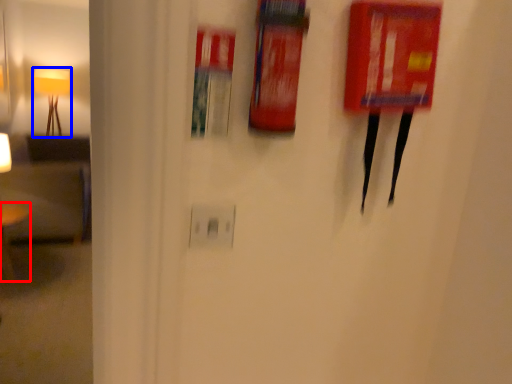
Question: Which object appears closest to the camera in this image, furniture (highlighted by a red box) or lamp (highlighted by a blue box)?

Choices:
 (A) furniture
 (B) lamp

Answer: (A)